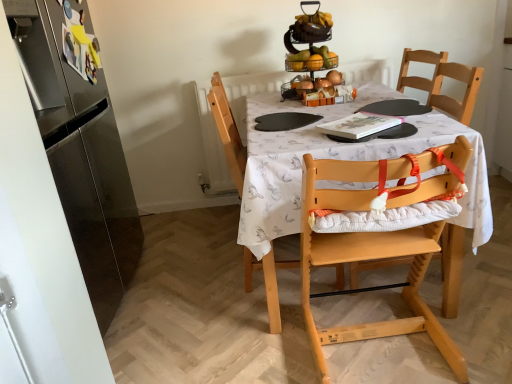
Locate an element on the screen. Image resolution: width=512 pixels, height=384 pixels. vacant area that is situated to the right of light wood highchair at center, positioned as the 2th chair in back-to-front order is located at coordinates (479, 322).